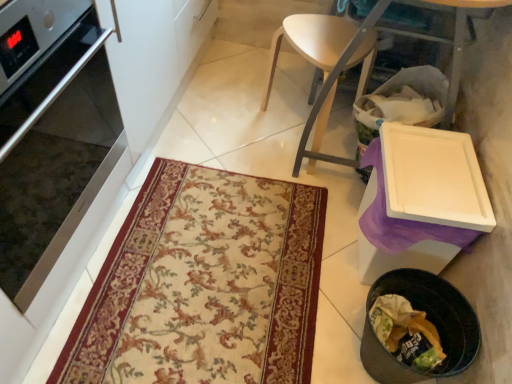
Question: Would you say beige floral rug at center is inside or outside white plastic cutting board at right?

Choices:
 (A) outside
 (B) inside

Answer: (A)

Question: Considering the positions of beige floral rug at center and white plastic cutting board at right in the image, is beige floral rug at center wider or thinner than white plastic cutting board at right?

Choices:
 (A) thin
 (B) wide

Answer: (B)

Question: Which is nearer to the black plastic trash can at lower right?

Choices:
 (A) white plastic cutting board at right
 (B) beige floral rug at center
 (C) satin silver oven at left
 (D) light wood chair at center

Answer: (B)

Question: Which object is the closest to the light wood chair at center?

Choices:
 (A) white plastic cutting board at right
 (B) satin silver oven at left
 (C) black plastic trash can at lower right
 (D) beige floral rug at center

Answer: (A)